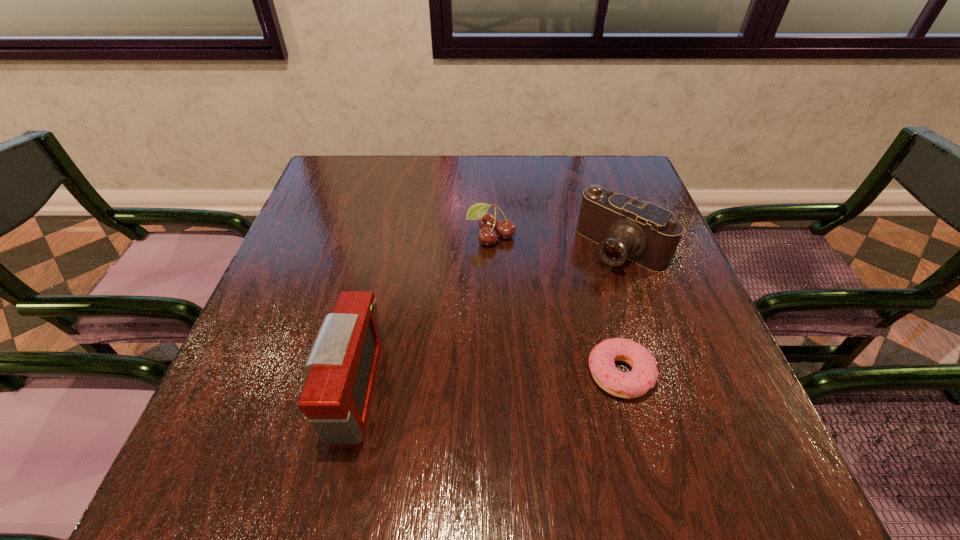
Locate an element on the screen. the nearer camera is located at coordinates (341, 369).

Where is `the leftmost object`? the leftmost object is located at coordinates (341, 369).

Where is `the shortest object`? the shortest object is located at coordinates (643, 376).

Find the location of a particular element. The width and height of the screenshot is (960, 540). the third tallest object is located at coordinates [x=488, y=222].

You are a GUI agent. You are given a task and a screenshot of the screen. Output one action in this format:
    pyautogui.click(x=<x>, y=<y>)
    Task: Click on the third object from right to left
    The width and height of the screenshot is (960, 540).
    Given the screenshot: What is the action you would take?
    pyautogui.click(x=488, y=222)

The width and height of the screenshot is (960, 540). What are the coordinates of `the farther camera` in the screenshot? It's located at (625, 228).

The width and height of the screenshot is (960, 540). I want to click on the right camera, so pyautogui.click(x=625, y=228).

Identify the location of blank area located on the front-facing side of the taller camera. The image size is (960, 540). point(292,389).

Where is `vacant space situated on the front-facing side of the taller camera`? The width and height of the screenshot is (960, 540). vacant space situated on the front-facing side of the taller camera is located at coordinates (236, 389).

Where is `vacant space situated 0.090m on the front-facing side of the taller camera`? The width and height of the screenshot is (960, 540). vacant space situated 0.090m on the front-facing side of the taller camera is located at coordinates (276, 389).